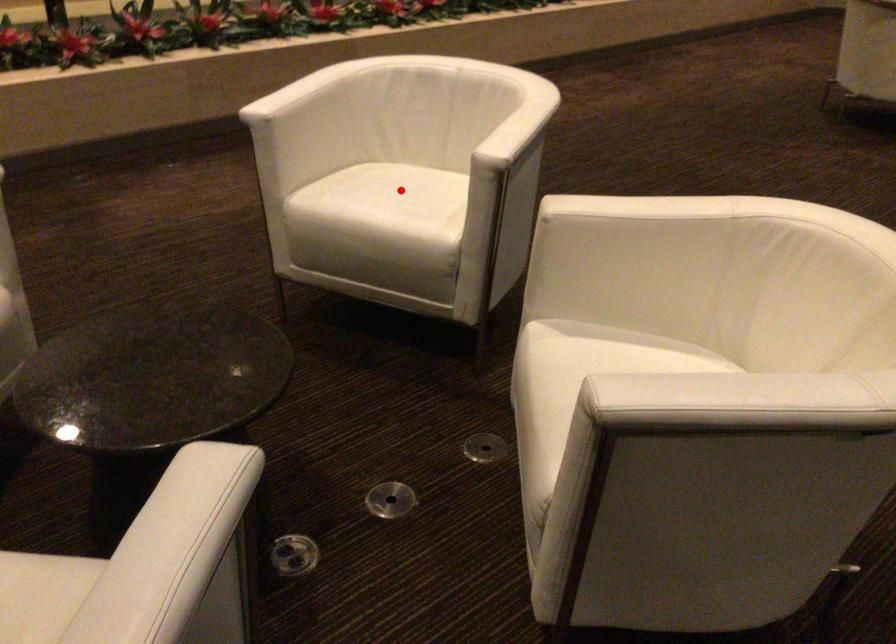
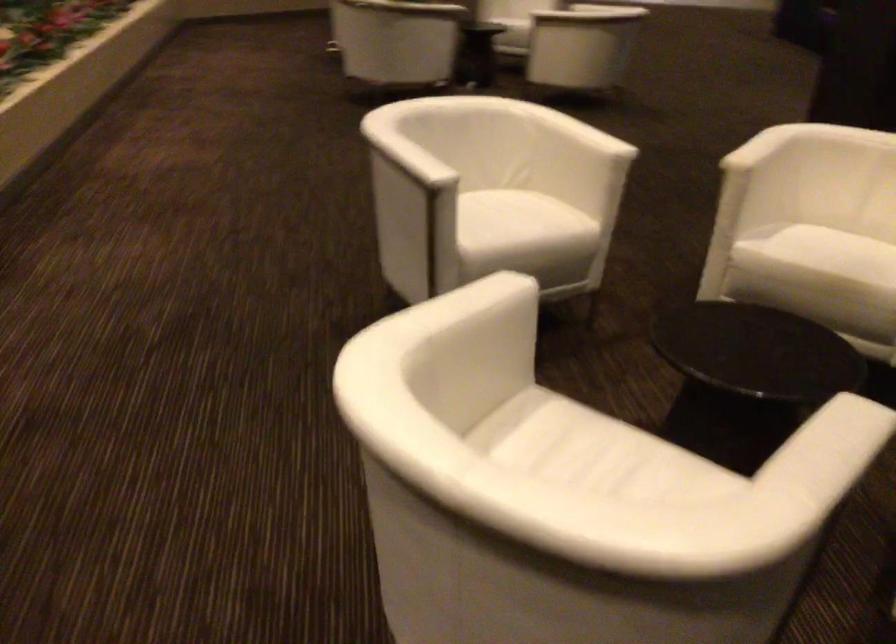
Question: I am providing you with two images of the same scene from different viewpoints. Image1 has a red point marked. In image2, the corresponding 3D location appears at what relative position? Reply with the corresponding letter.

Choices:
 (A) Closer
 (B) Farther

Answer: (B)